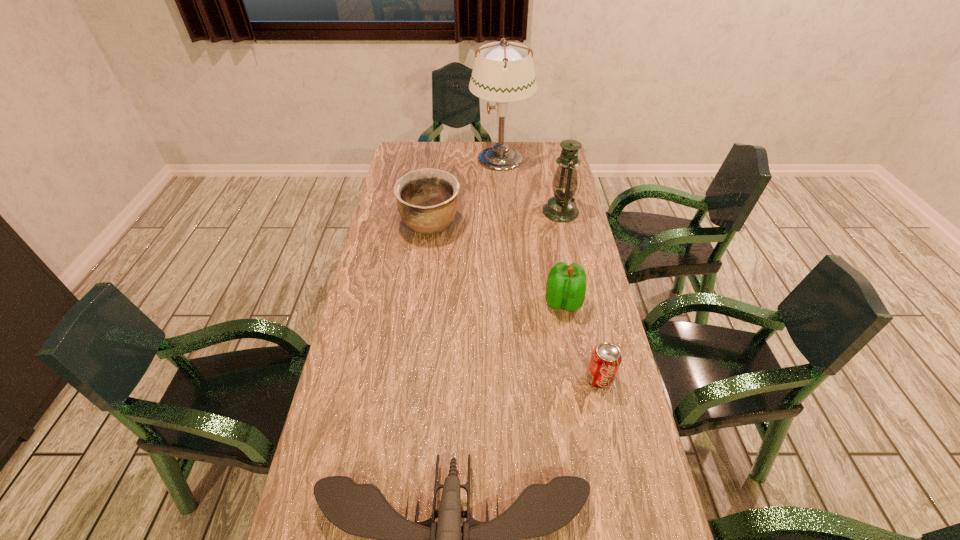
Locate an element on the screen. The height and width of the screenshot is (540, 960). free space located 0.170m on the front of the oil lamp is located at coordinates (570, 256).

The height and width of the screenshot is (540, 960). I want to click on free location located 0.050m on the back of the pottery, so click(434, 199).

Image resolution: width=960 pixels, height=540 pixels. I want to click on free location located on the front of the bell pepper, so click(x=590, y=455).

Image resolution: width=960 pixels, height=540 pixels. What are the coordinates of `vacant space located on the front of the soda can` in the screenshot? It's located at (620, 471).

I want to click on object positioned at the far edge, so click(503, 72).

Find the location of a particular element. Image resolution: width=960 pixels, height=540 pixels. object present at the left edge is located at coordinates (427, 200).

The width and height of the screenshot is (960, 540). What are the coordinates of `lampshade situated at the right edge` in the screenshot? It's located at (503, 72).

What are the coordinates of `oil lamp at the right edge` in the screenshot? It's located at (561, 207).

Identify the location of bell pepper at the right edge. (566, 284).

Identify the location of soda can present at the right edge. The height and width of the screenshot is (540, 960). (605, 360).